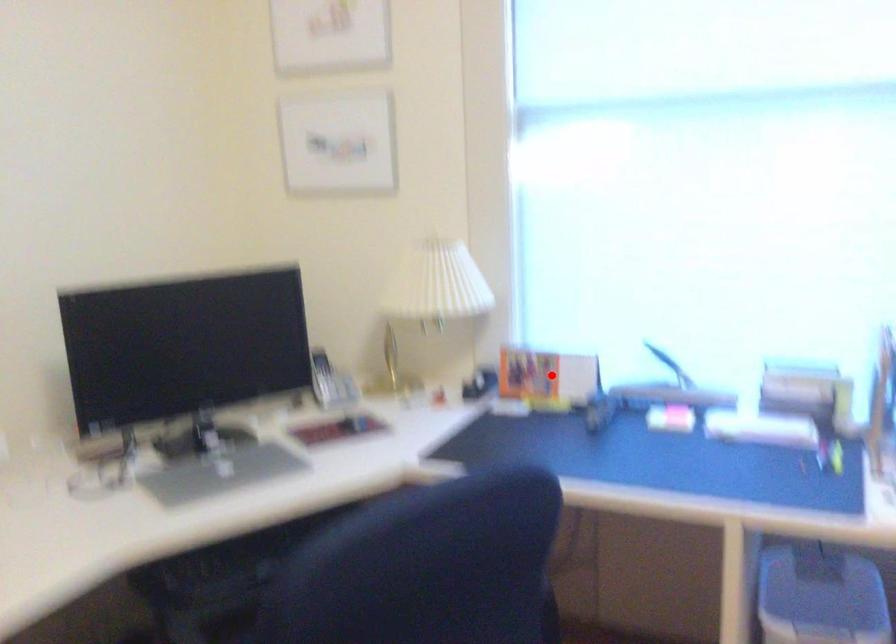
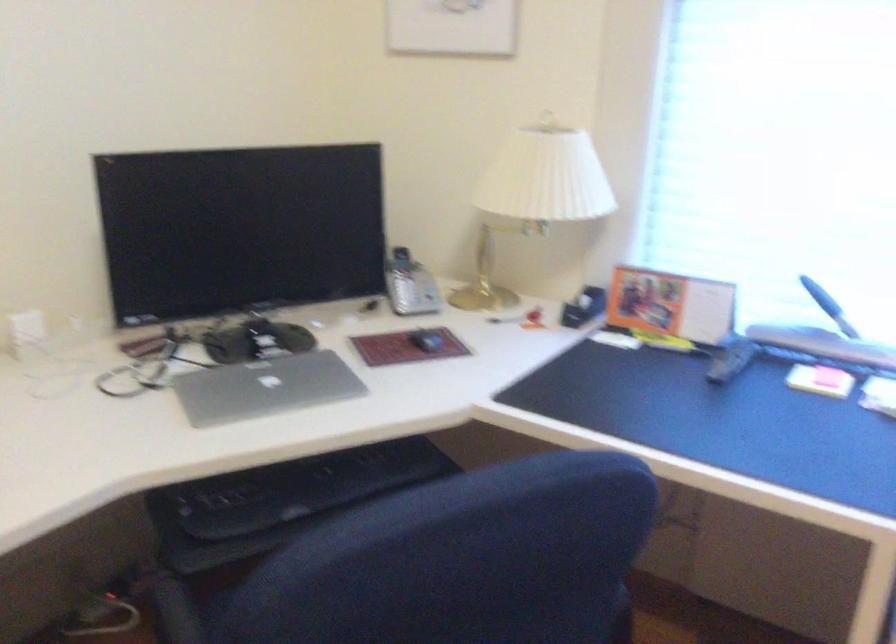
Locate, in the second image, the point that corresponds to the highlighted location in the first image.

(670, 305)